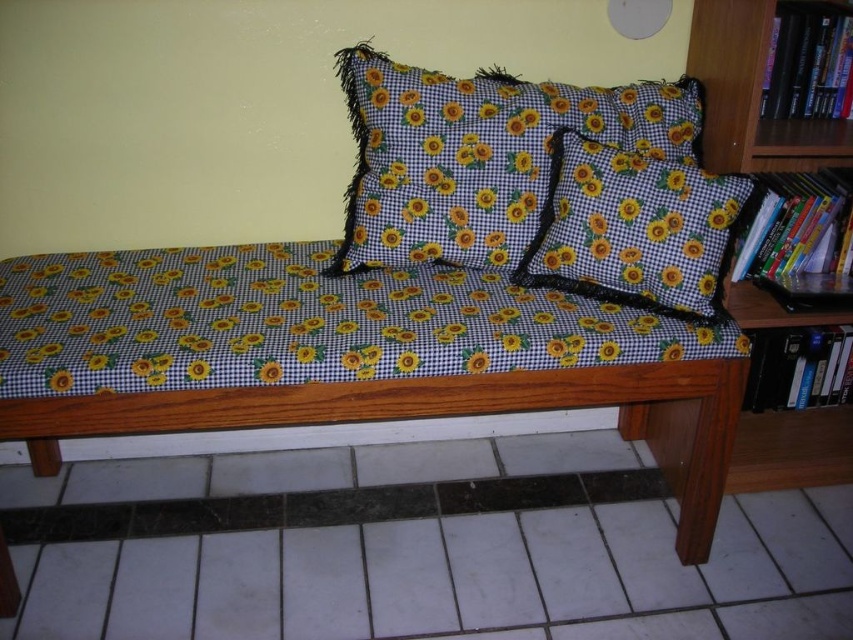
Question: Which point is farther to the camera?

Choices:
 (A) (769, 268)
 (B) (144, 376)
 (C) (445, 179)
 (D) (596, 186)

Answer: (A)

Question: Which point is farther to the camera?

Choices:
 (A) wooden bench at center
 (B) black checkered pillow with sunflowers at center
 (C) black hardcover book at right
 (D) yellow-green fabric pillow at center

Answer: (C)

Question: Among these objects, which one is nearest to the camera?

Choices:
 (A) wooden bench at center
 (B) black hardcover book at right

Answer: (A)

Question: Can you confirm if wooden bench at center is smaller than yellow-green fabric pillow at center?

Choices:
 (A) yes
 (B) no

Answer: (B)

Question: Can you confirm if black checkered pillow with sunflowers at center is positioned below yellow-green fabric pillow at center?

Choices:
 (A) no
 (B) yes

Answer: (A)

Question: Does black checkered pillow with sunflowers at center appear over hardcover book at upper right?

Choices:
 (A) no
 (B) yes

Answer: (A)